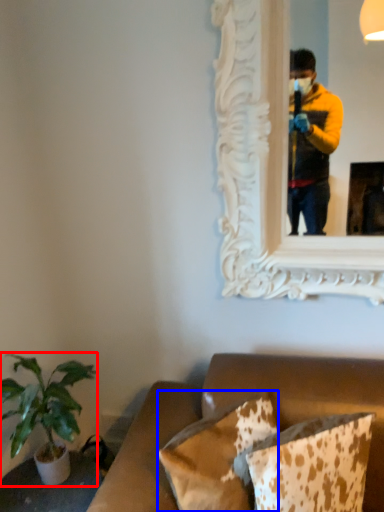
Question: Which object appears closest to the camera in this image, houseplant (highlighted by a red box) or pillow (highlighted by a blue box)?

Choices:
 (A) houseplant
 (B) pillow

Answer: (B)